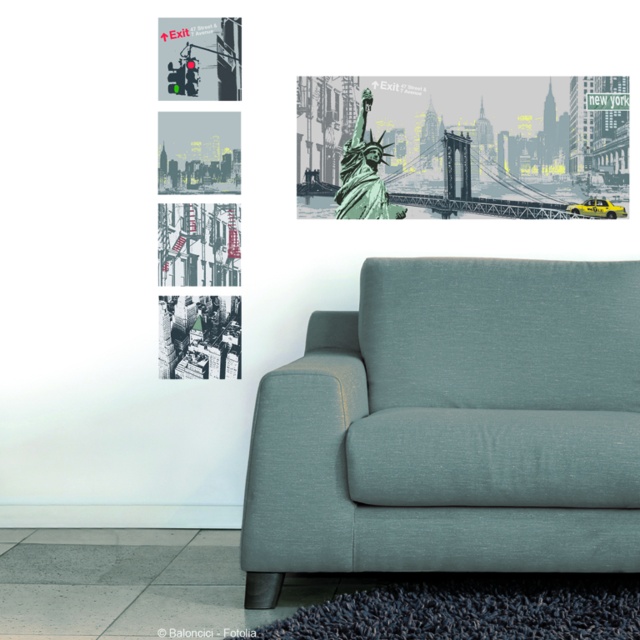
Question: Can you confirm if matte gray fabric couch at center is positioned above green matte statue at upper center?

Choices:
 (A) yes
 (B) no

Answer: (B)

Question: Which is farther from the matte gray fabric couch at center?

Choices:
 (A) green matte statue at upper center
 (B) gray matte cityscape at upper left
 (C) metallic traffic light at upper left
 (D) green statue at upper center

Answer: (C)

Question: Where is metallic traffic light at upper left located in relation to gray matte cityscape at upper left in the image?

Choices:
 (A) right
 (B) left

Answer: (A)

Question: Does matte gray fabric couch at center have a lesser width compared to green matte statue at upper center?

Choices:
 (A) yes
 (B) no

Answer: (B)

Question: Which of the following is the closest to the observer?

Choices:
 (A) (358, 141)
 (B) (332, 500)
 (C) (520, 163)
 (D) (186, 20)

Answer: (B)

Question: Estimate the real-world distances between objects in this image. Which object is closer to the gray matte cityscape at upper left?

Choices:
 (A) green matte statue at upper center
 (B) matte gray fabric couch at center
 (C) metallic traffic light at upper left

Answer: (C)